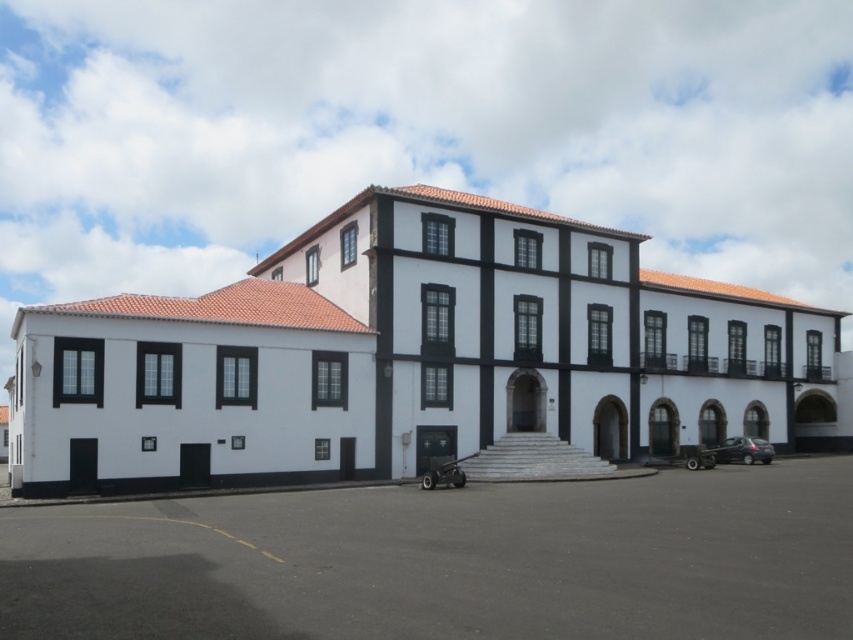
Who is taller, black matte trim at center or dark asphalt parking lot at center?

Standing taller between the two is black matte trim at center.

Which is behind, point (701, 344) or point (605, 618)?

The point (701, 344) is behind.

Where is `black matte trim at center`? Image resolution: width=853 pixels, height=640 pixels. black matte trim at center is located at coordinates [410, 356].